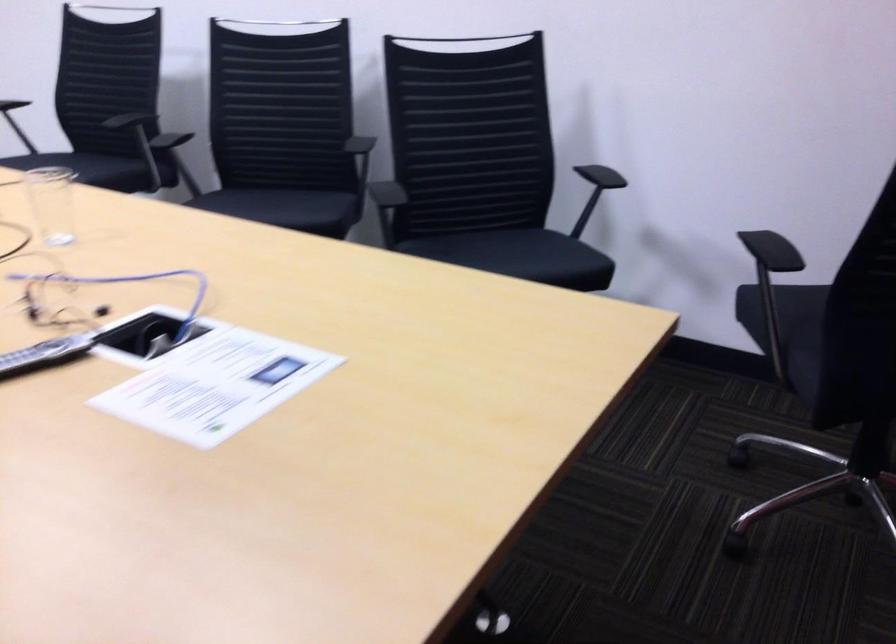
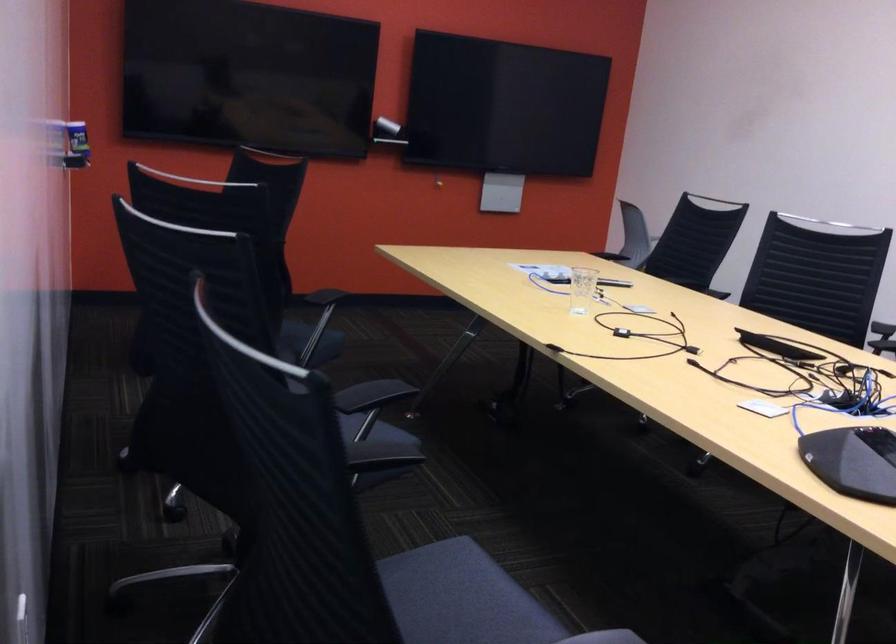
Find the pixel in the second image that matches point (403, 252) in the first image.

(308, 342)